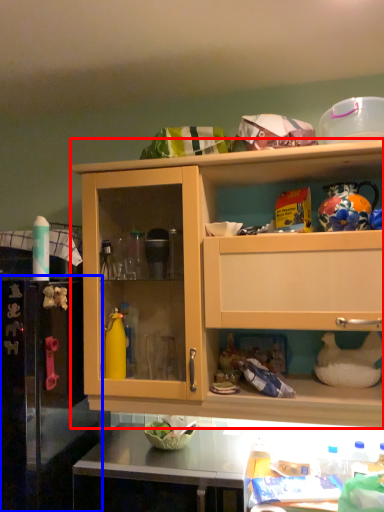
Question: Which point is further to the camera, cabinetry (highlighted by a red box) or appliance (highlighted by a blue box)?

Choices:
 (A) cabinetry
 (B) appliance

Answer: (A)